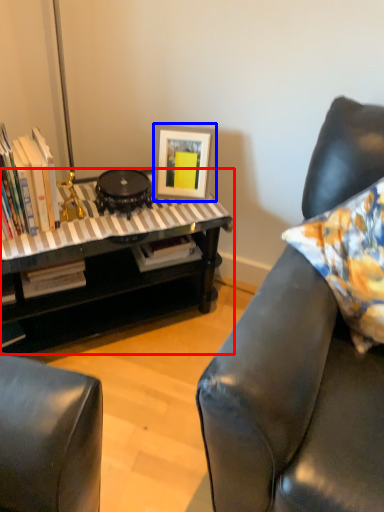
Question: Which point is closer to the camera, table (highlighted by a red box) or picture frame (highlighted by a blue box)?

Choices:
 (A) table
 (B) picture frame

Answer: (A)